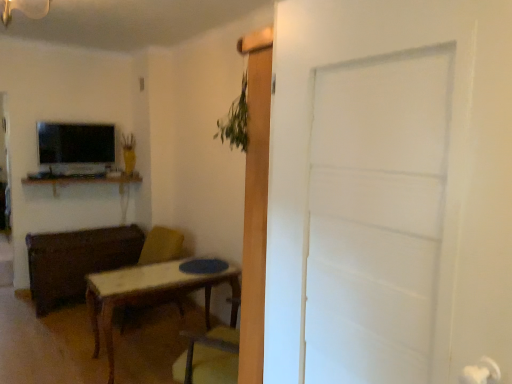
Question: Considering the relative positions of matte black tv at upper left and wooden desk at upper left in the image provided, is matte black tv at upper left behind wooden desk at upper left?

Choices:
 (A) yes
 (B) no

Answer: (A)

Question: Is matte black tv at upper left oriented away from wooden desk at upper left?

Choices:
 (A) yes
 (B) no

Answer: (B)

Question: From a real-world perspective, is matte black tv at upper left beneath wooden desk at upper left?

Choices:
 (A) yes
 (B) no

Answer: (B)

Question: Does matte black tv at upper left have a greater height compared to wooden desk at upper left?

Choices:
 (A) no
 (B) yes

Answer: (B)

Question: Is the depth of matte black tv at upper left less than that of wooden desk at upper left?

Choices:
 (A) yes
 (B) no

Answer: (B)

Question: Is point (54, 152) positioned closer to the camera than point (455, 66)?

Choices:
 (A) closer
 (B) farther

Answer: (B)

Question: From the image's perspective, is matte black tv at upper left positioned above or below white matte door at center?

Choices:
 (A) above
 (B) below

Answer: (A)

Question: From a real-world perspective, is matte black tv at upper left above or below white matte door at center?

Choices:
 (A) below
 (B) above

Answer: (B)

Question: Considering the positions of matte black tv at upper left and white matte door at center in the image, is matte black tv at upper left wider or thinner than white matte door at center?

Choices:
 (A) thin
 (B) wide

Answer: (B)

Question: From the image's perspective, is white matte door at center located above or below matte black tv at upper left?

Choices:
 (A) above
 (B) below

Answer: (B)

Question: Relative to matte black tv at upper left, is white matte door at center in front or behind?

Choices:
 (A) behind
 (B) front

Answer: (B)

Question: Would you say white matte door at center is to the left or to the right of matte black tv at upper left in the picture?

Choices:
 (A) left
 (B) right

Answer: (B)

Question: Is point (364, 294) closer or farther from the camera than point (102, 127)?

Choices:
 (A) closer
 (B) farther

Answer: (A)

Question: Visually, is matte black tv at upper left positioned to the left or to the right of wooden desk at upper left?

Choices:
 (A) right
 (B) left

Answer: (B)

Question: Is matte black tv at upper left wider or thinner than wooden desk at upper left?

Choices:
 (A) wide
 (B) thin

Answer: (B)